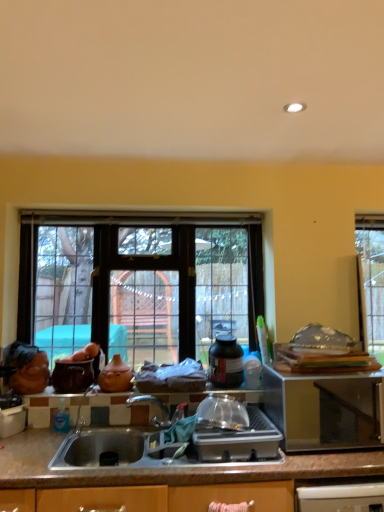
Question: Considering the relative sizes of clear plastic container at center and matte ceramic vase at center in the image provided, is clear plastic container at center taller than matte ceramic vase at center?

Choices:
 (A) no
 (B) yes

Answer: (B)

Question: Considering the relative sizes of clear plastic container at center and matte ceramic vase at center in the image provided, is clear plastic container at center bigger than matte ceramic vase at center?

Choices:
 (A) yes
 (B) no

Answer: (A)

Question: Does clear plastic container at center appear on the right side of matte ceramic vase at center?

Choices:
 (A) yes
 (B) no

Answer: (A)

Question: Is clear plastic container at center with matte ceramic vase at center?

Choices:
 (A) no
 (B) yes

Answer: (A)

Question: From the image's perspective, is clear plastic container at center over matte ceramic vase at center?

Choices:
 (A) yes
 (B) no

Answer: (B)

Question: From a real-world perspective, is brown granite countertop at lower center above or below blue translucent bottle at sink, which is the 2th bottle in top-to-bottom order?

Choices:
 (A) below
 (B) above

Answer: (A)

Question: From the image's perspective, is brown granite countertop at lower center located above or below blue translucent bottle at sink, which is counted as the 1th bottle, starting from the bottom?

Choices:
 (A) below
 (B) above

Answer: (A)

Question: Based on their positions, is brown granite countertop at lower center located to the left or right of blue translucent bottle at sink, acting as the first bottle starting from the left?

Choices:
 (A) left
 (B) right

Answer: (B)

Question: Considering the positions of brown granite countertop at lower center and blue translucent bottle at sink, which is the 2th bottle in top-to-bottom order, in the image, is brown granite countertop at lower center wider or thinner than blue translucent bottle at sink, which is the 2th bottle in top-to-bottom order,?

Choices:
 (A) thin
 (B) wide

Answer: (B)

Question: Based on their positions, is matte ceramic vase at center located to the left or right of clear plastic container at center?

Choices:
 (A) left
 (B) right

Answer: (A)

Question: Is point (187, 398) closer or farther from the camera than point (258, 458)?

Choices:
 (A) farther
 (B) closer

Answer: (A)

Question: In terms of height, does matte ceramic vase at center look taller or shorter compared to clear plastic container at center?

Choices:
 (A) short
 (B) tall

Answer: (A)

Question: In terms of size, does matte ceramic vase at center appear bigger or smaller than clear plastic container at center?

Choices:
 (A) small
 (B) big

Answer: (A)

Question: Relative to matte brown pot at left, which is the first appliance from left to right, is stainless steel microwave at right, which ranks as the second appliance in left-to-right order, in front or behind?

Choices:
 (A) behind
 (B) front

Answer: (B)

Question: Visually, is stainless steel microwave at right, which ranks as the second appliance in left-to-right order, positioned to the left or to the right of matte brown pot at left, which is the 2th appliance from right to left?

Choices:
 (A) left
 (B) right

Answer: (B)